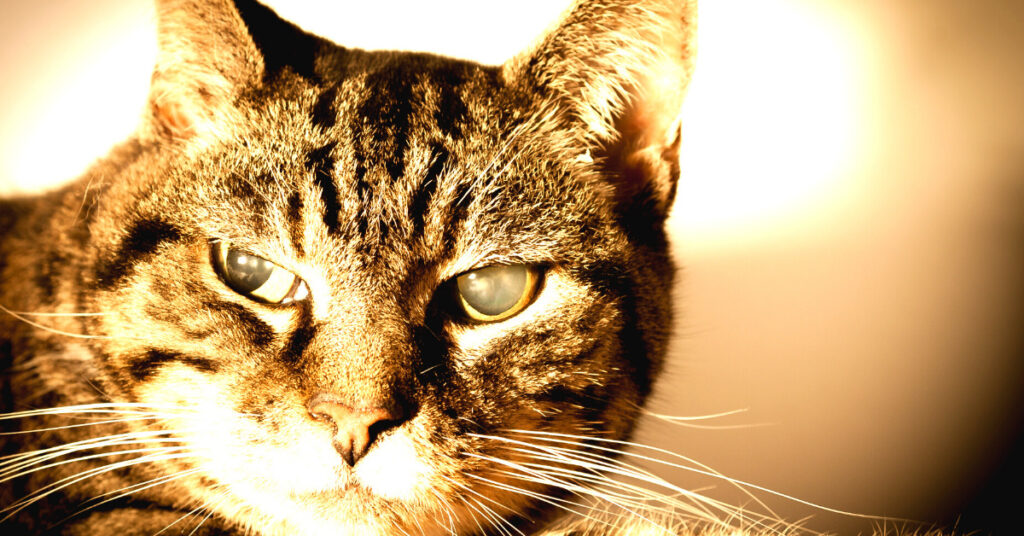
What are the coordinates of `light reflections` in the screenshot? It's located at (475, 285), (255, 270).